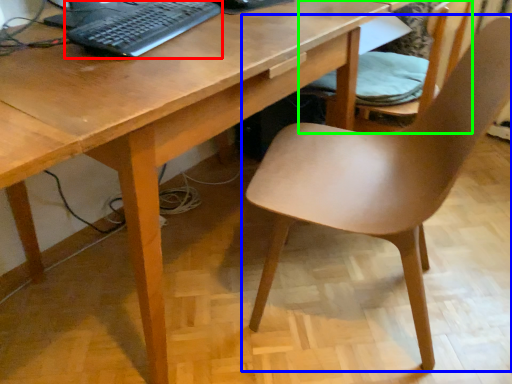
Question: Based on their relative distances, which object is nearer to computer keyboard (highlighted by a red box)? Choose from chair (highlighted by a blue box) and chair (highlighted by a green box).

Choices:
 (A) chair
 (B) chair

Answer: (A)